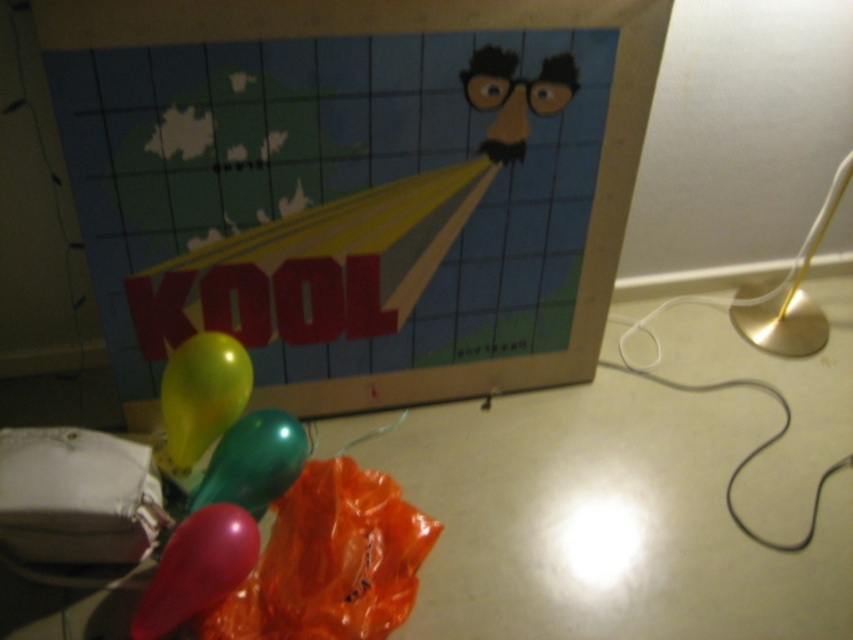
Question: Which of the following is the farthest from the observer?

Choices:
 (A) (173, 532)
 (B) (753, 328)

Answer: (B)

Question: Observing the image, what is the correct spatial positioning of matte plastic balloons at lower left in reference to shiny metallic balloon at center?

Choices:
 (A) right
 (B) left

Answer: (A)

Question: Which of the following is the closest to the observer?

Choices:
 (A) green glossy balloon at lower left
 (B) matte cardboard poster at center

Answer: (B)

Question: Is matte cardboard poster at center bigger than shiny metallic balloon at center?

Choices:
 (A) yes
 (B) no

Answer: (A)

Question: From the image, what is the correct spatial relationship of shiny metallic balloon at center in relation to green glossy balloon at lower left?

Choices:
 (A) above
 (B) below

Answer: (A)

Question: Which of these objects is positioned closest to the gold metallic table lamp at right?

Choices:
 (A) shiny metallic balloon at center
 (B) matte plastic balloons at lower left
 (C) rubber balloon at lower left
 (D) matte cardboard poster at center

Answer: (B)